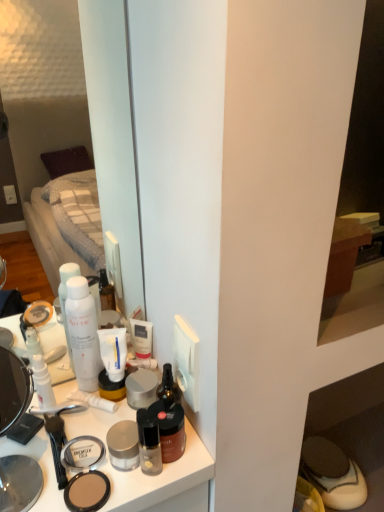
The image size is (384, 512). Find the location of `free space to the right of matte brown shoe at lower right`. free space to the right of matte brown shoe at lower right is located at coordinates (370, 471).